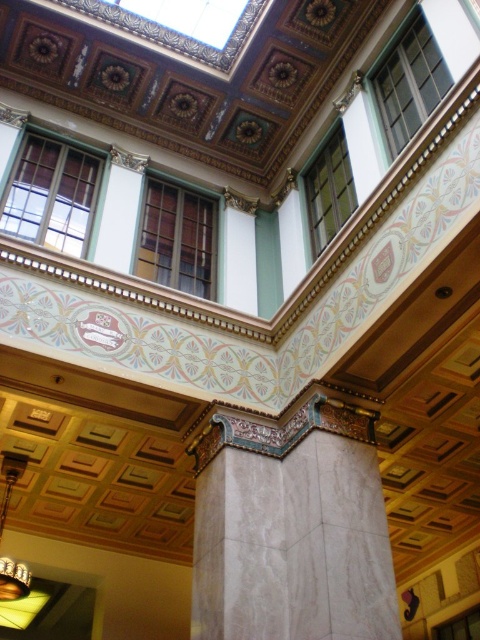
You are an interior designer planning to place a new sofa in the room. The sofa must be placed between the white marble column at center and the gold metallic chandelier at lower left. Based on their positions, which side of the chandelier should the sofa be placed on?

The white marble column at center is positioned on the right side of the gold metallic chandelier at lower left. Therefore, the sofa should be placed on the right side of the gold metallic chandelier at lower left to be between them.